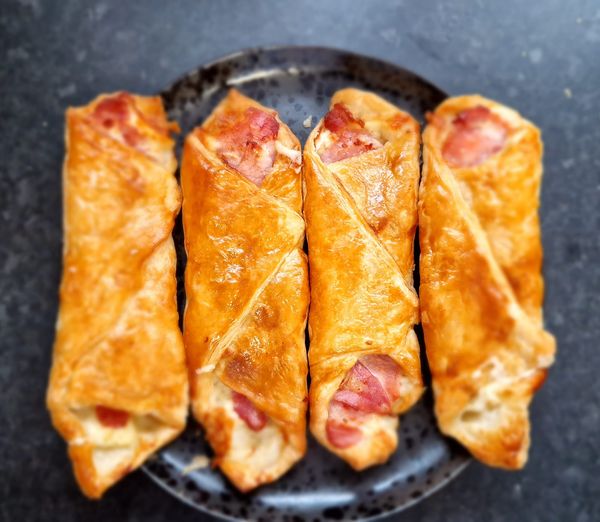
You are a GUI agent. You are given a task and a screenshot of the screen. Output one action in this format:
    pyautogui.click(x=<x>, y=<y>)
    Task: Click on the gray and black speckled plate
    The image size is (600, 522).
    Given the screenshot: What is the action you would take?
    pyautogui.click(x=312, y=469)